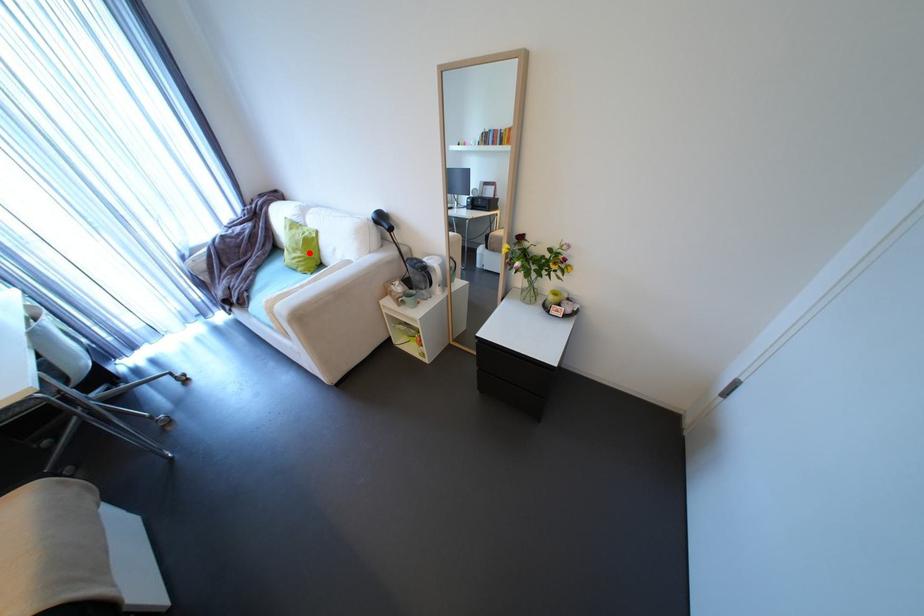
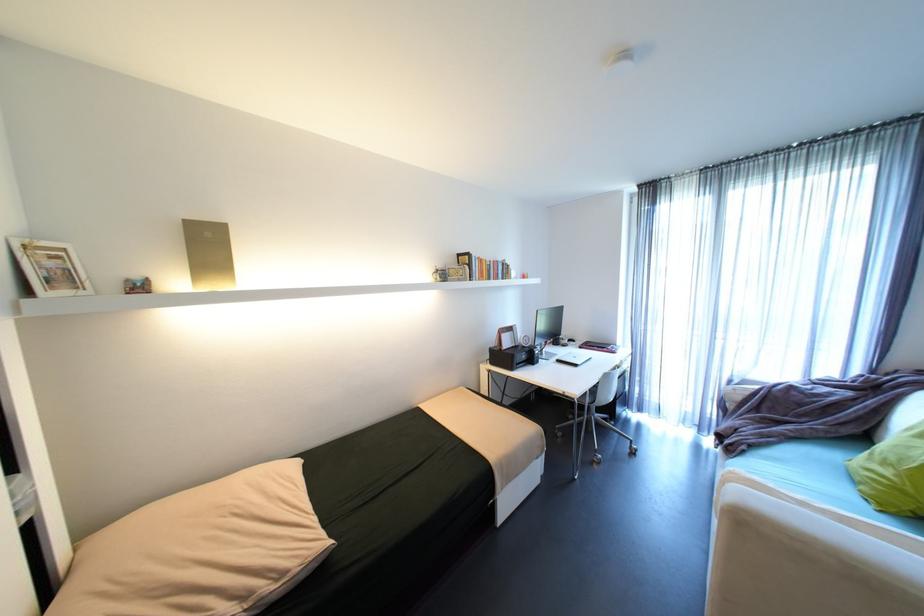
Question: I am providing you with two images of the same scene from different viewpoints. Given a red point in image1, look at the same physical point in image2. Is it:

Choices:
 (A) Closer to the viewpoint
 (B) Farther from the viewpoint

Answer: (B)